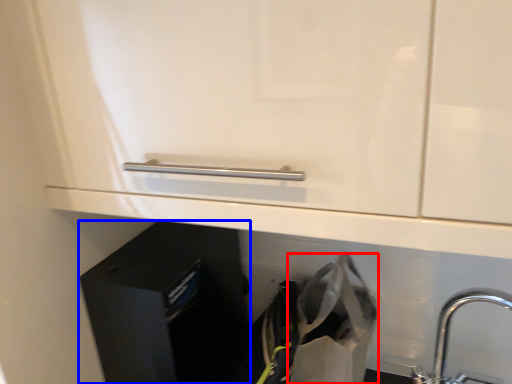
Question: Which object appears farthest to the camera in this image, shopping bag (highlighted by a red box) or file cabinet (highlighted by a blue box)?

Choices:
 (A) shopping bag
 (B) file cabinet

Answer: (B)